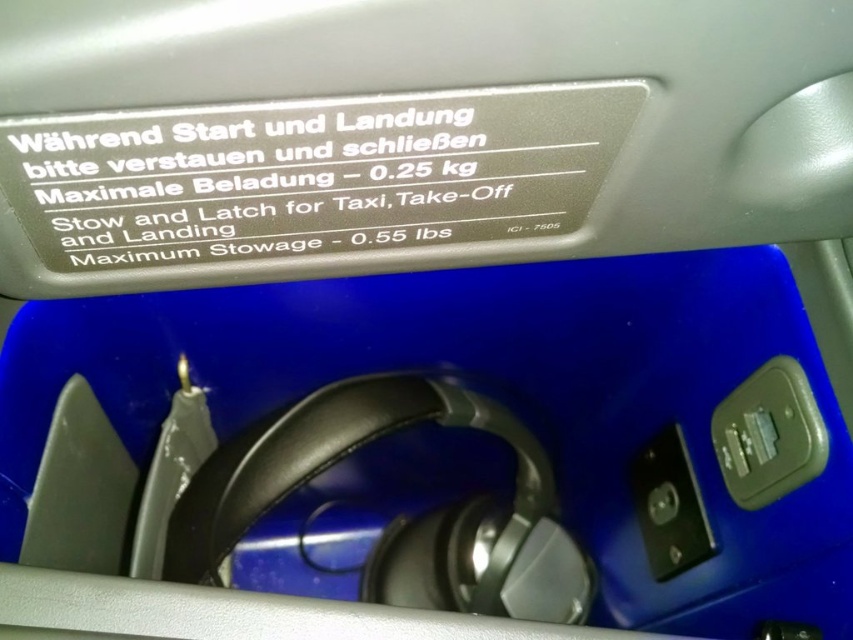
Question: Considering the relative positions of matte gray speaker at upper right and metallic silver speaker at lower right in the image provided, where is matte gray speaker at upper right located with respect to metallic silver speaker at lower right?

Choices:
 (A) right
 (B) left

Answer: (A)

Question: Which point is farther to the camera?

Choices:
 (A) (665, 538)
 (B) (820, 433)

Answer: (A)

Question: Does matte gray speaker at upper right lie in front of metallic silver speaker at lower right?

Choices:
 (A) yes
 (B) no

Answer: (A)

Question: Which point is farther to the camera?

Choices:
 (A) matte gray speaker at upper right
 (B) metallic silver speaker at lower right

Answer: (B)

Question: Is matte gray speaker at upper right to the right of metallic silver speaker at lower right from the viewer's perspective?

Choices:
 (A) no
 (B) yes

Answer: (B)